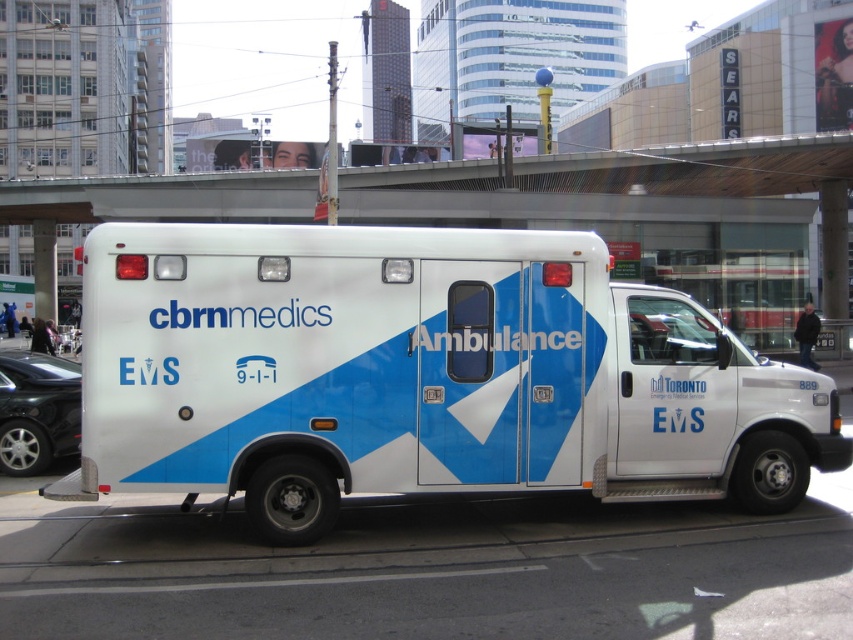
Does point (383, 368) come farther from viewer compared to point (824, 346)?

No.

Between point (289, 404) and point (822, 336), which one is positioned behind?

The point (822, 336) is behind.

Between point (223, 260) and point (819, 339), which one is positioned in front?

Point (223, 260)

Where is `white glossy ambulance at center`? The height and width of the screenshot is (640, 853). white glossy ambulance at center is located at coordinates click(421, 374).

Does white glossy ambulance at center appear under concrete bridge at upper center?

Yes.

Which of these two, white glossy ambulance at center or concrete bridge at upper center, stands shorter?

white glossy ambulance at center

Is point (664, 332) more distant than point (103, 186)?

No, (664, 332) is closer to viewer.

Locate an element on the screen. white glossy ambulance at center is located at coordinates (421, 374).

Does concrete bridge at upper center have a lesser width compared to shiny black car at lower left?

In fact, concrete bridge at upper center might be wider than shiny black car at lower left.

The width and height of the screenshot is (853, 640). Describe the element at coordinates (618, 173) in the screenshot. I see `concrete bridge at upper center` at that location.

Between point (432, 189) and point (74, 374), which one is positioned in front?

Positioned in front is point (74, 374).

This screenshot has width=853, height=640. Find the location of `concrete bridge at upper center`. concrete bridge at upper center is located at coordinates (618, 173).